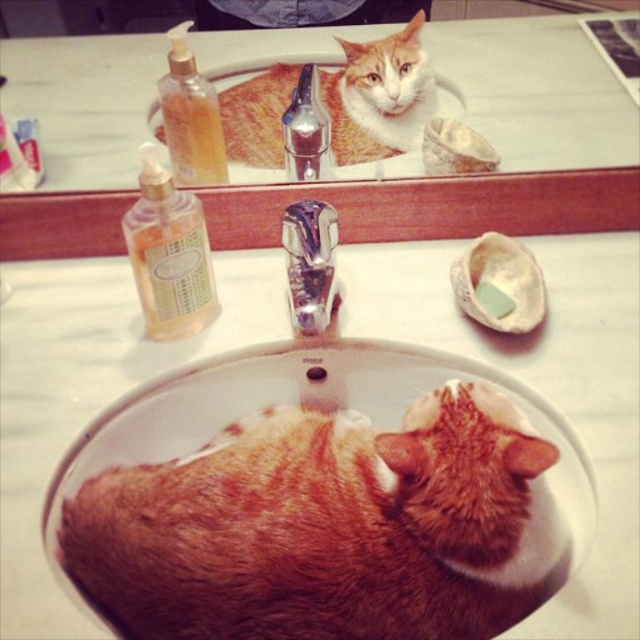
Is silver metallic faucet at center positioned before white matte soap at sink center?

Yes, silver metallic faucet at center is closer to the viewer.

Which is behind, point (308, 332) or point (509, 300)?

The point (509, 300) is more distant.

At what (x,y) coordinates should I click in order to perform the action: click on silver metallic faucet at center. Please return your answer as a coordinate pair (x, y). The height and width of the screenshot is (640, 640). Looking at the image, I should click on (310, 262).

Is point (266, 440) more distant than point (152, 301)?

No.

Can you confirm if orange fur cat at center is smaller than translucent glass soap dispenser at left?

Actually, orange fur cat at center might be larger than translucent glass soap dispenser at left.

Does point (481, 580) come farther from viewer compared to point (124, 228)?

No, (481, 580) is closer to viewer.

I want to click on orange fur cat at center, so click(328, 528).

From the picture: Is translucent glass soap dispenser at left thinner than silver metallic faucet at center?

Incorrect, translucent glass soap dispenser at left's width is not less than silver metallic faucet at center's.

Between translucent glass soap dispenser at left and silver metallic faucet at center, which one appears on the left side from the viewer's perspective?

From the viewer's perspective, translucent glass soap dispenser at left appears more on the left side.

Identify the location of translucent glass soap dispenser at left. (168, 253).

Identify the location of translucent glass soap dispenser at left. The width and height of the screenshot is (640, 640). (168, 253).